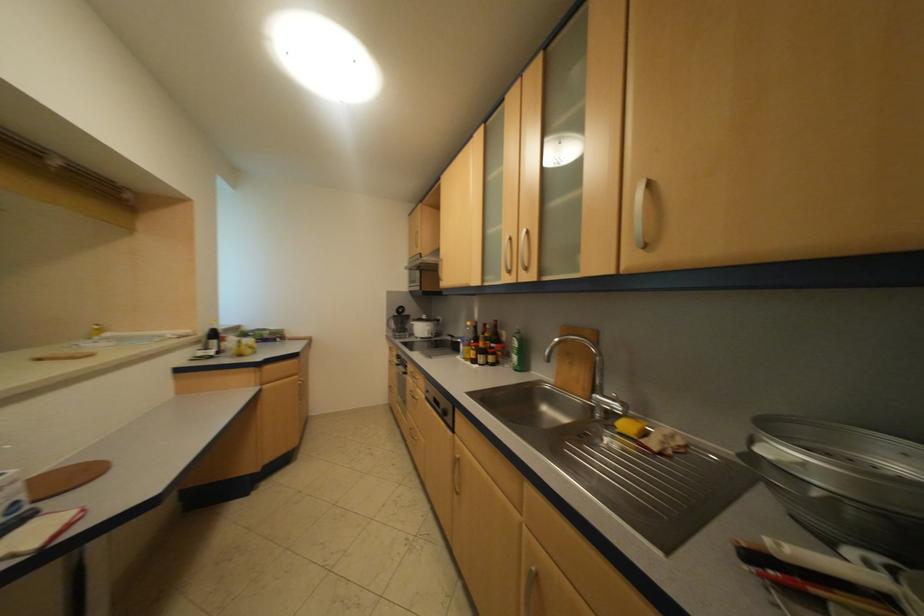
What are the coordinates of `yellow sponge` in the screenshot? It's located at (630, 427).